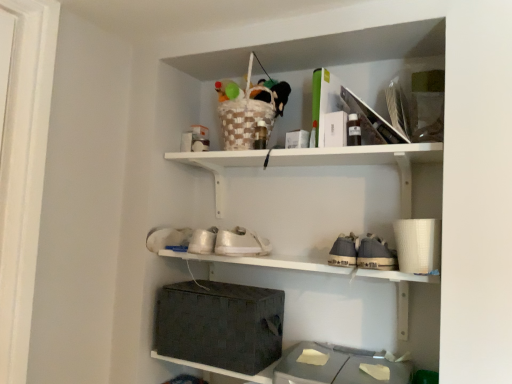
You are a GUI agent. You are given a task and a screenshot of the screen. Output one action in this format:
    pyautogui.click(x=<x>, y=<y>)
    Task: Click on the gray woven basket at lower center, the first storage box when ordered from right to left
    Image resolution: width=512 pixels, height=384 pixels.
    Given the screenshot: What is the action you would take?
    pyautogui.click(x=335, y=368)

Find the location of a particular element. The width and height of the screenshot is (512, 384). woven fabric storage box at lower center, positioned as the first storage box in left-to-right order is located at coordinates (220, 325).

Can you confirm if white matte shoe at center, marked as the first shoe in a right-to-left arrangement, is shorter than white matte shelf at upper center, which is the second shelf in bottom-to-top order?

Correct, white matte shoe at center, marked as the first shoe in a right-to-left arrangement, is not as tall as white matte shelf at upper center, which is the second shelf in bottom-to-top order.

From a real-world perspective, is white matte shoe at center, marked as the first shoe in a right-to-left arrangement, positioned above or below white matte shelf at upper center, the first shelf positioned from the top?

In terms of real-world spatial position, white matte shoe at center, marked as the first shoe in a right-to-left arrangement, is below white matte shelf at upper center, the first shelf positioned from the top.

From the white matte shelf at upper center, the first shelf positioned from the top, count 1st shoes backward and point to it. Please provide its 2D coordinates.

[(241, 243)]

From the image's perspective, is woven fabric basket at center, which ranks as the 2th shelf in top-to-bottom order, over white matte shelf at upper center, the first shelf positioned from the top?

No, from the image's perspective, woven fabric basket at center, which ranks as the 2th shelf in top-to-bottom order, is not over white matte shelf at upper center, the first shelf positioned from the top.

Is woven fabric basket at center, which ranks as the 2th shelf in top-to-bottom order, next to white matte shelf at upper center, which is the second shelf in bottom-to-top order, and touching it?

woven fabric basket at center, which ranks as the 2th shelf in top-to-bottom order, and white matte shelf at upper center, which is the second shelf in bottom-to-top order, are not in contact.

Which is behind, point (404, 316) or point (307, 263)?

The point (404, 316) is farther from the camera.

In terms of height, does woven fabric basket at center, which appears as the 1th shelf when ordered from the bottom, look taller or shorter compared to white matte shelf at upper center, the first shelf positioned from the top?

woven fabric basket at center, which appears as the 1th shelf when ordered from the bottom, is shorter than white matte shelf at upper center, the first shelf positioned from the top.

In the image, is woven fabric storage box at lower center, the 2th storage box in the right-to-left sequence, positioned in front of or behind white matte shelf at upper center, the first shelf positioned from the top?

woven fabric storage box at lower center, the 2th storage box in the right-to-left sequence, is behind white matte shelf at upper center, the first shelf positioned from the top.

Who is bigger, woven fabric storage box at lower center, positioned as the first storage box in left-to-right order, or white matte shelf at upper center, the first shelf positioned from the top?

With larger size is white matte shelf at upper center, the first shelf positioned from the top.

Is woven fabric storage box at lower center, positioned as the first storage box in left-to-right order, inside or outside of white matte shelf at upper center, the first shelf positioned from the top?

The correct answer is: outside.

Is white matte shelf at upper center, which is the second shelf in bottom-to-top order, at the back of woven fabric storage box at lower center, the 2th storage box in the right-to-left sequence?

woven fabric storage box at lower center, the 2th storage box in the right-to-left sequence, does not have its back to white matte shelf at upper center, which is the second shelf in bottom-to-top order.

Is gray woven basket at lower center, the first storage box when ordered from right to left, aimed at white matte shelf at upper center, which is the second shelf in bottom-to-top order?

No, gray woven basket at lower center, the first storage box when ordered from right to left, does not turn towards white matte shelf at upper center, which is the second shelf in bottom-to-top order.

Considering the positions of objects gray woven basket at lower center, which ranks as the 2th storage box in left-to-right order, and white matte shelf at upper center, which is the second shelf in bottom-to-top order, in the image provided, who is more to the right, gray woven basket at lower center, which ranks as the 2th storage box in left-to-right order, or white matte shelf at upper center, which is the second shelf in bottom-to-top order,?

Positioned to the right is gray woven basket at lower center, which ranks as the 2th storage box in left-to-right order.

Based on the photo, is the surface of gray woven basket at lower center, which ranks as the 2th storage box in left-to-right order, in direct contact with white matte shelf at upper center, the first shelf positioned from the top?

No, gray woven basket at lower center, which ranks as the 2th storage box in left-to-right order, is not touching white matte shelf at upper center, the first shelf positioned from the top.

From the image's perspective, count 2nd storage boxs downward from the woven fabric basket at center, which ranks as the 2th shelf in top-to-bottom order, and point to it. Please provide its 2D coordinates.

[(335, 368)]

Which is behind, point (200, 366) or point (345, 371)?

The point (200, 366) is farther from the camera.

Is woven fabric basket at center, which appears as the 1th shelf when ordered from the bottom, touching gray woven basket at lower center, which ranks as the 2th storage box in left-to-right order?

woven fabric basket at center, which appears as the 1th shelf when ordered from the bottom, is not next to gray woven basket at lower center, which ranks as the 2th storage box in left-to-right order, and they're not touching.

The height and width of the screenshot is (384, 512). There is a white matte shelf at upper center, which is the second shelf in bottom-to-top order. In order to click on the 2nd shoe below it (from a real-world perspective) in this screenshot , I will do `click(167, 238)`.

Is point (218, 183) closer or farther from the camera than point (177, 232)?

Point (218, 183) is positioned farther from the camera compared to point (177, 232).

Is white matte shelf at upper center, the first shelf positioned from the top, further to the viewer compared to white matte shoe at lower left, which is the 2th shoe from right to left?

No, it is not.

Are white matte shelf at upper center, which is the second shelf in bottom-to-top order, and white matte shoe at lower left, the first shoe in the left-to-right sequence, beside each other?

No, white matte shelf at upper center, which is the second shelf in bottom-to-top order, is not making contact with white matte shoe at lower left, the first shoe in the left-to-right sequence.

How different are the orientations of gray woven basket at lower center, which ranks as the 2th storage box in left-to-right order, and woven fabric basket at center, which appears as the 1th shelf when ordered from the bottom, in degrees?

The angular difference between gray woven basket at lower center, which ranks as the 2th storage box in left-to-right order, and woven fabric basket at center, which appears as the 1th shelf when ordered from the bottom, is 0.361 degrees.

Which shelf is the 1st one when counting from the back of the gray woven basket at lower center, which ranks as the 2th storage box in left-to-right order? Please provide its 2D coordinates.

[(261, 263)]

Does gray woven basket at lower center, which ranks as the 2th storage box in left-to-right order, lie in front of woven fabric basket at center, which ranks as the 2th shelf in top-to-bottom order?

Yes, gray woven basket at lower center, which ranks as the 2th storage box in left-to-right order, is closer to the viewer.

Which object is wider, gray woven basket at lower center, the first storage box when ordered from right to left, or woven fabric basket at center, which appears as the 1th shelf when ordered from the bottom?

Wider between the two is gray woven basket at lower center, the first storage box when ordered from right to left.

Find the location of a particular element. The height and width of the screenshot is (384, 512). the 1st shelf in front of the white matte shoe at center, marked as the first shoe in a right-to-left arrangement, starting your count from the anchor is located at coordinates (366, 161).

Identify the location of shelf above the woven fabric basket at center, which appears as the 1th shelf when ordered from the bottom (from the image's perspective). [366, 161].

When comparing their distances from woven fabric basket at center, which ranks as the 2th shelf in top-to-bottom order, does woven fabric storage box at lower center, the 2th storage box in the right-to-left sequence, or white matte shelf at upper center, the first shelf positioned from the top, seem further?

woven fabric storage box at lower center, the 2th storage box in the right-to-left sequence, is positioned further to the anchor woven fabric basket at center, which ranks as the 2th shelf in top-to-bottom order.

When comparing their distances from white matte shoe at lower left, the first shoe in the left-to-right sequence, does woven fabric storage box at lower center, positioned as the first storage box in left-to-right order, or gray woven basket at lower center, which ranks as the 2th storage box in left-to-right order, seem further?

gray woven basket at lower center, which ranks as the 2th storage box in left-to-right order, lies further to white matte shoe at lower left, the first shoe in the left-to-right sequence, than the other object.

Looking at this image, estimate the real-world distances between objects in this image. Which object is further from woven fabric storage box at lower center, positioned as the first storage box in left-to-right order, gray woven basket at lower center, which ranks as the 2th storage box in left-to-right order, or white matte shoe at lower left, the first shoe in the left-to-right sequence?

white matte shoe at lower left, the first shoe in the left-to-right sequence, lies further to woven fabric storage box at lower center, positioned as the first storage box in left-to-right order, than the other object.

Based on their spatial positions, is white matte shelf at upper center, which is the second shelf in bottom-to-top order, or white matte shoe at center, which is counted as the 2th shoe, starting from the left, closer to gray woven basket at lower center, the first storage box when ordered from right to left?

Based on the image, white matte shoe at center, which is counted as the 2th shoe, starting from the left, appears to be nearer to gray woven basket at lower center, the first storage box when ordered from right to left.

Considering their positions, is woven fabric storage box at lower center, the 2th storage box in the right-to-left sequence, positioned closer to white matte shelf at upper center, which is the second shelf in bottom-to-top order, than gray woven basket at lower center, the first storage box when ordered from right to left?

woven fabric storage box at lower center, the 2th storage box in the right-to-left sequence, is closer to white matte shelf at upper center, which is the second shelf in bottom-to-top order.

Looking at the image, which one is located closer to gray woven basket at lower center, which ranks as the 2th storage box in left-to-right order, white matte shelf at upper center, the first shelf positioned from the top, or woven fabric storage box at lower center, positioned as the first storage box in left-to-right order?

Among the two, woven fabric storage box at lower center, positioned as the first storage box in left-to-right order, is located nearer to gray woven basket at lower center, which ranks as the 2th storage box in left-to-right order.

When comparing their distances from white matte shoe at lower left, which is the 2th shoe from right to left, does white matte shoe at center, which is counted as the 2th shoe, starting from the left, or woven fabric basket at center, which ranks as the 2th shelf in top-to-bottom order, seem closer?

The object closer to white matte shoe at lower left, which is the 2th shoe from right to left, is white matte shoe at center, which is counted as the 2th shoe, starting from the left.

Considering their positions, is woven fabric basket at center, which appears as the 1th shelf when ordered from the bottom, positioned further to white matte shoe at center, marked as the first shoe in a right-to-left arrangement, than woven fabric storage box at lower center, the 2th storage box in the right-to-left sequence?

The object further to white matte shoe at center, marked as the first shoe in a right-to-left arrangement, is woven fabric storage box at lower center, the 2th storage box in the right-to-left sequence.

You are a GUI agent. You are given a task and a screenshot of the screen. Output one action in this format:
    pyautogui.click(x=<x>, y=<y>)
    Task: Click on the shelf that lies between white matte shoe at center, which is counted as the 2th shoe, starting from the left, and gray woven basket at lower center, which ranks as the 2th storage box in left-to-right order, from top to bottom
    The width and height of the screenshot is (512, 384).
    Given the screenshot: What is the action you would take?
    pyautogui.click(x=261, y=263)

You are a GUI agent. You are given a task and a screenshot of the screen. Output one action in this format:
    pyautogui.click(x=<x>, y=<y>)
    Task: Click on the shoe situated between white matte shoe at lower left, the first shoe in the left-to-right sequence, and woven fabric basket at center, which ranks as the 2th shelf in top-to-bottom order, from left to right
    This screenshot has width=512, height=384.
    Given the screenshot: What is the action you would take?
    pyautogui.click(x=241, y=243)

The height and width of the screenshot is (384, 512). Find the location of `shoe situated between white matte shoe at lower left, the first shoe in the left-to-right sequence, and white matte shelf at upper center, which is the second shelf in bottom-to-top order, from left to right`. shoe situated between white matte shoe at lower left, the first shoe in the left-to-right sequence, and white matte shelf at upper center, which is the second shelf in bottom-to-top order, from left to right is located at coordinates (241, 243).

Find the location of a particular element. The height and width of the screenshot is (384, 512). shelf between white matte shelf at upper center, the first shelf positioned from the top, and woven fabric storage box at lower center, the 2th storage box in the right-to-left sequence, vertically is located at coordinates (261, 263).